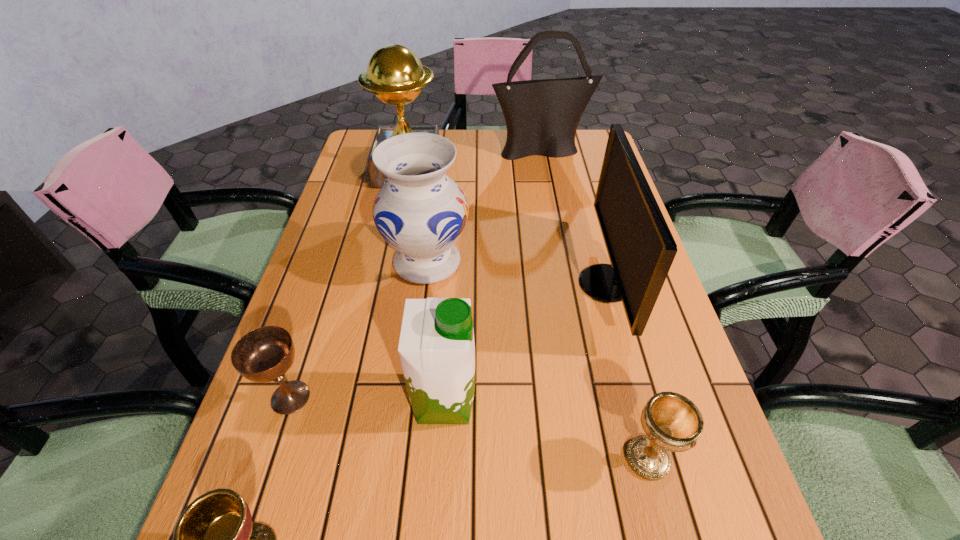
This screenshot has width=960, height=540. Identify the location of vacant area that lies between the second farthest chalice and the award. (528, 315).

The width and height of the screenshot is (960, 540). I want to click on empty location between the soya milk and the award, so click(426, 286).

The height and width of the screenshot is (540, 960). I want to click on free space between the second farthest chalice and the soya milk, so click(546, 430).

You are a GUI agent. You are given a task and a screenshot of the screen. Output one action in this format:
    pyautogui.click(x=<x>, y=<y>)
    Task: Click on the vacant area that lies between the soya milk and the shoulder bag
    Image resolution: width=960 pixels, height=540 pixels.
    Given the screenshot: What is the action you would take?
    pyautogui.click(x=492, y=275)

Identify the location of free point between the shoulder bag and the computer monitor. (573, 217).

This screenshot has width=960, height=540. Identify the location of empty space that is in between the farthest chalice and the vase. (359, 329).

Select which object is the fourth closest to the shoulder bag. Please provide its 2D coordinates. Your answer should be formatted as a tuple, i.e. [(x, y)], where the tuple contains the x and y coordinates of a point satisfying the conditions above.

[(436, 347)]

The image size is (960, 540). Find the location of `object that ranks as the closest to the second nearest chalice`. object that ranks as the closest to the second nearest chalice is located at coordinates (641, 249).

Locate which chalice is the third closest to the shoulder bag. Please provide its 2D coordinates. Your answer should be formatted as a tuple, i.e. [(x, y)], where the tuple contains the x and y coordinates of a point satisfying the conditions above.

[(214, 539)]

Identify which chalice is the closest to the vase. Please provide its 2D coordinates. Your answer should be formatted as a tuple, i.e. [(x, y)], where the tuple contains the x and y coordinates of a point satisfying the conditions above.

[(265, 354)]